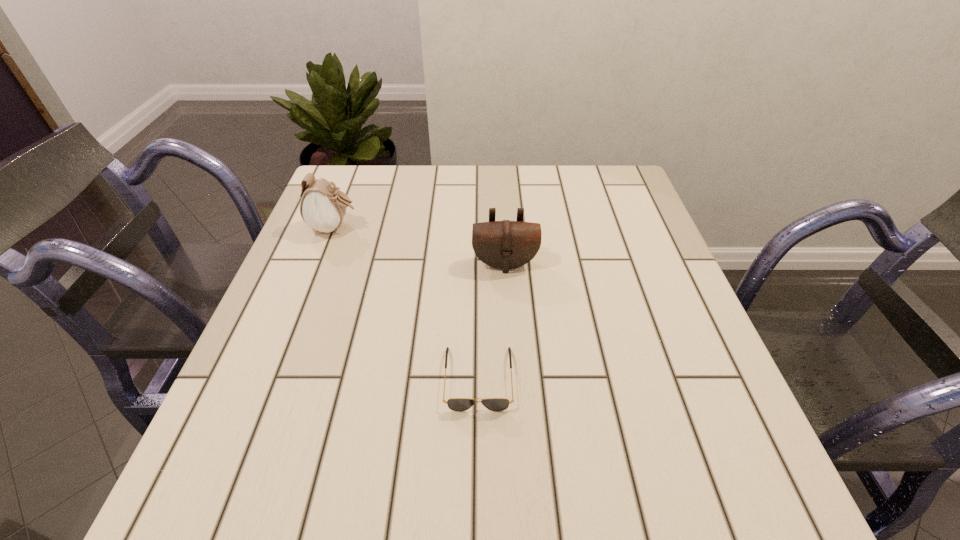
Locate an element on the screen. The height and width of the screenshot is (540, 960). the left pouch is located at coordinates (323, 207).

This screenshot has height=540, width=960. Find the location of `the farther pouch`. the farther pouch is located at coordinates (323, 207).

You are a GUI agent. You are given a task and a screenshot of the screen. Output one action in this format:
    pyautogui.click(x=<x>, y=<y>)
    Task: Click on the right pouch
    
    Given the screenshot: What is the action you would take?
    pyautogui.click(x=506, y=244)

Find the location of a particular element. This screenshot has height=540, width=960. the second nearest object is located at coordinates (506, 244).

I want to click on the nearest object, so click(x=456, y=404).

You are a GUI agent. You are given a task and a screenshot of the screen. Output one action in this format:
    pyautogui.click(x=<x>, y=<y>)
    Task: Click on the sunglasses
    Image resolution: width=960 pixels, height=540 pixels.
    Given the screenshot: What is the action you would take?
    pyautogui.click(x=456, y=404)

The width and height of the screenshot is (960, 540). Identify the location of free location located on the front-facing side of the farther pouch. (424, 228).

Identify the location of vacant space located with the flap open on the nearer pouch. This screenshot has width=960, height=540. (509, 332).

Image resolution: width=960 pixels, height=540 pixels. In order to click on free space located 0.100m on the front-facing side of the nearest object in this screenshot , I will do `click(478, 472)`.

Locate an element on the screen. object that is at the left edge is located at coordinates (323, 207).